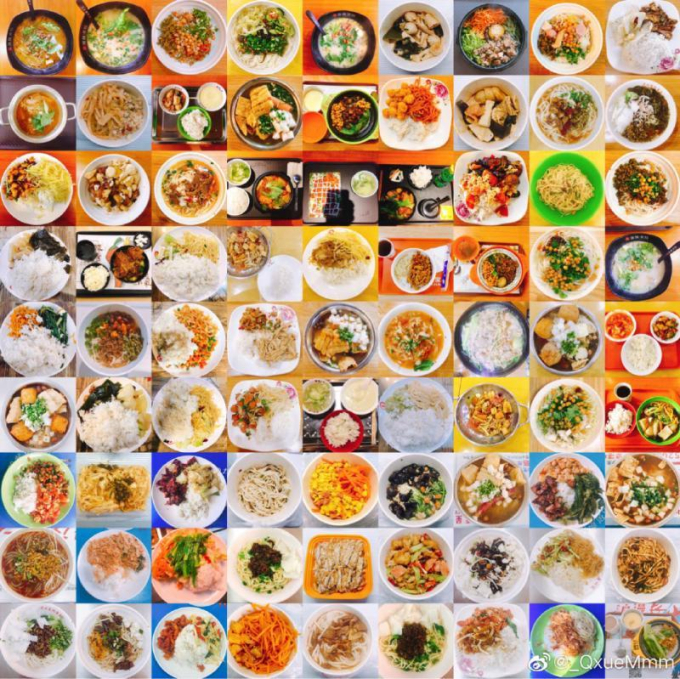
Where is `left row of photographs`? left row of photographs is located at coordinates (41, 41), (37, 113), (35, 185), (34, 265), (35, 337), (35, 416), (34, 493), (37, 561), (39, 629).